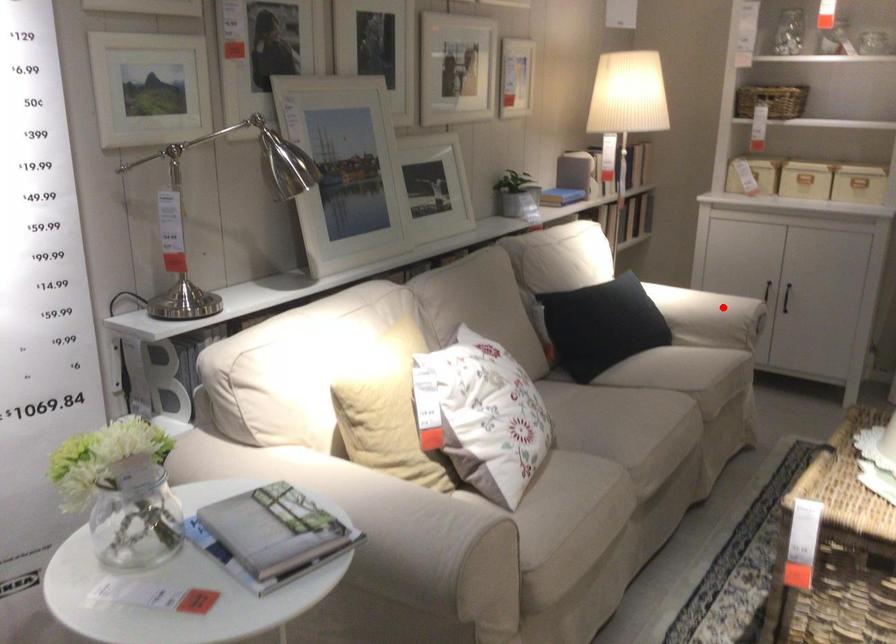
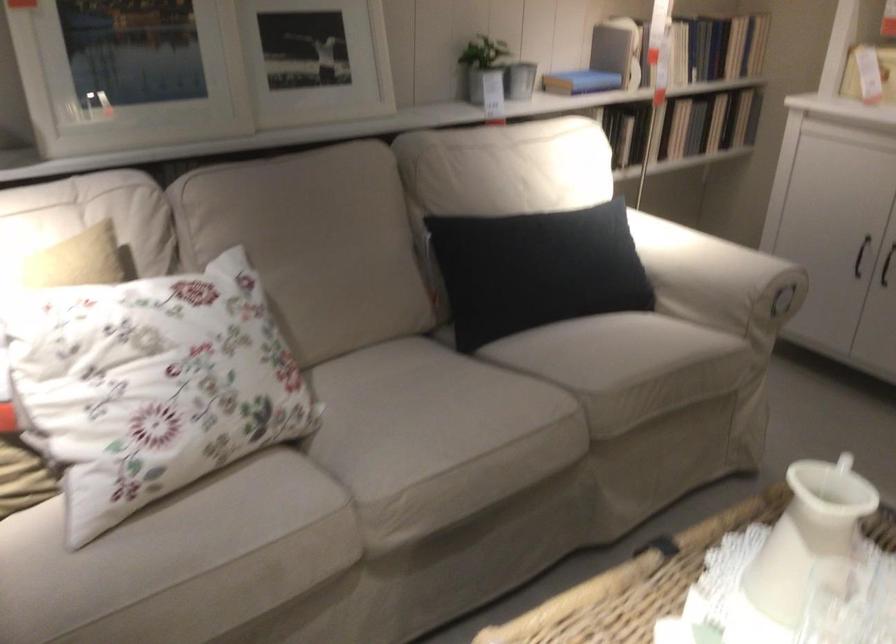
In the second image, find the point that corresponds to the highlighted location in the first image.

(717, 279)